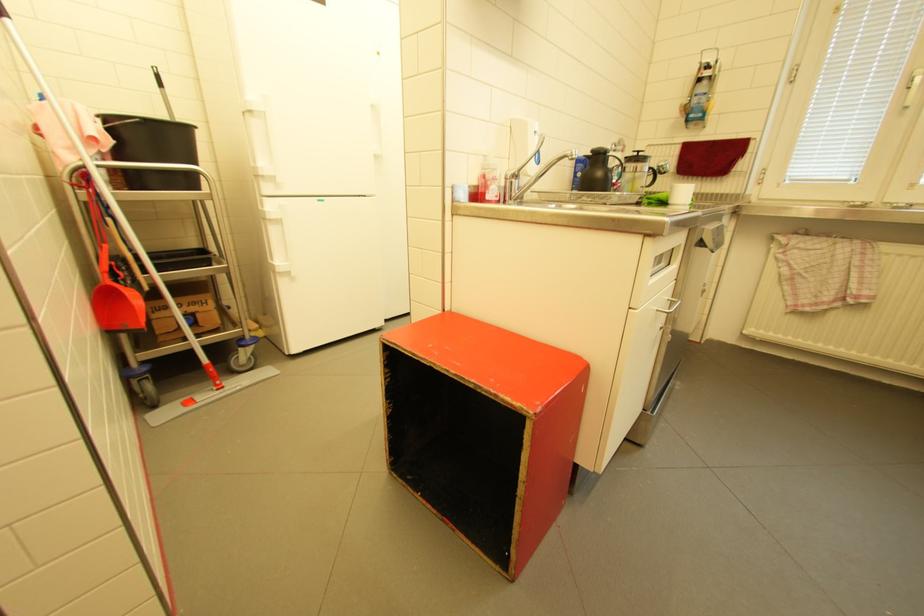
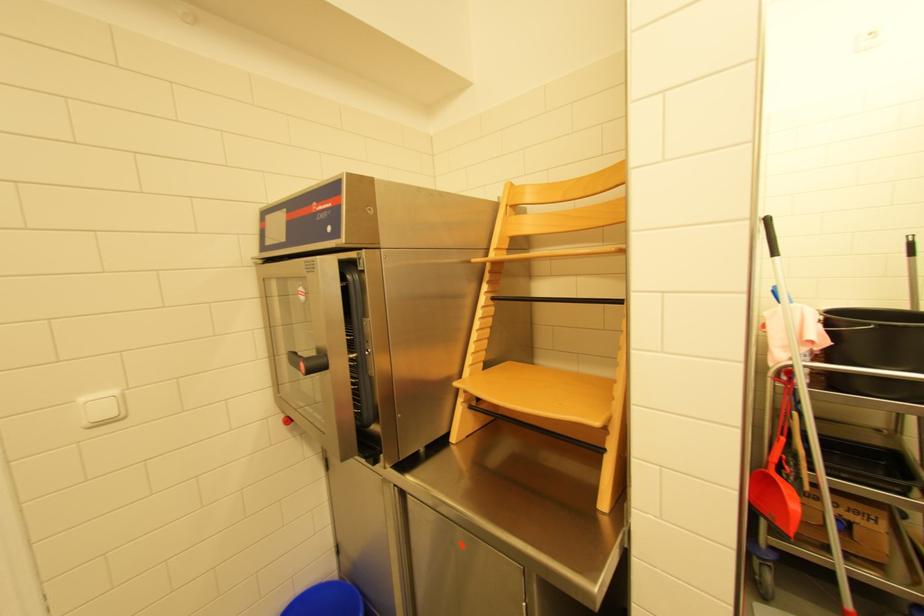
Where in the second image is the point corresponding to (x=91, y=199) from the first image?

(787, 391)